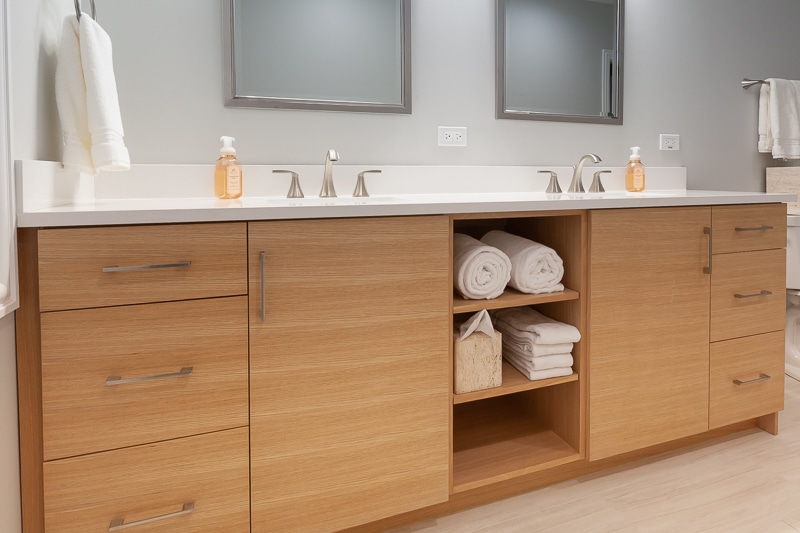
Image resolution: width=800 pixels, height=533 pixels. What are the coordinates of `left drawers` in the screenshot? It's located at (201, 343), (209, 256), (210, 486).